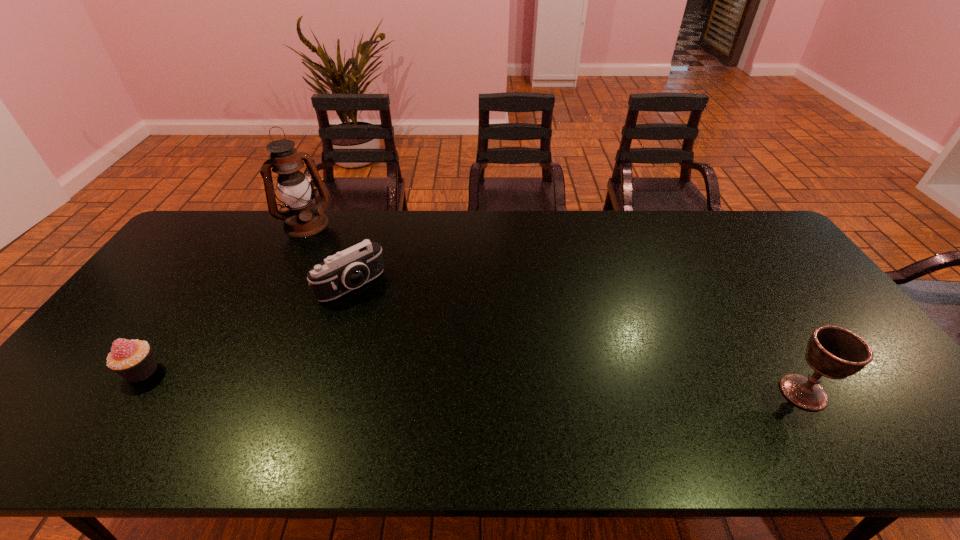
The height and width of the screenshot is (540, 960). Find the location of `object that is at the near left corner`. object that is at the near left corner is located at coordinates (132, 359).

The height and width of the screenshot is (540, 960). Identify the location of free space at the far edge. (646, 220).

The height and width of the screenshot is (540, 960). I want to click on free space at the near edge of the desktop, so point(523,394).

Identify the location of free space at the left edge. This screenshot has width=960, height=540. (140, 330).

Image resolution: width=960 pixels, height=540 pixels. What are the coordinates of `vacant space at the right edge of the desktop` in the screenshot? It's located at [x=803, y=318].

You are a GUI agent. You are given a task and a screenshot of the screen. Output one action in this format:
    pyautogui.click(x=<x>, y=<y>)
    Task: Click on the vacant space at the near left corner
    Image resolution: width=960 pixels, height=540 pixels.
    Given the screenshot: What is the action you would take?
    pyautogui.click(x=121, y=384)

Locate an element on the screen. vacant area between the shortest object and the tallest object is located at coordinates (224, 298).

Locate an element on the screen. free space between the tallest object and the camera is located at coordinates (328, 254).

Locate an element on the screen. The height and width of the screenshot is (540, 960). vacant area that lies between the farthest object and the leftmost object is located at coordinates (224, 298).

In order to click on unoccupied position between the farthest object and the second tallest object in this screenshot , I will do `click(554, 308)`.